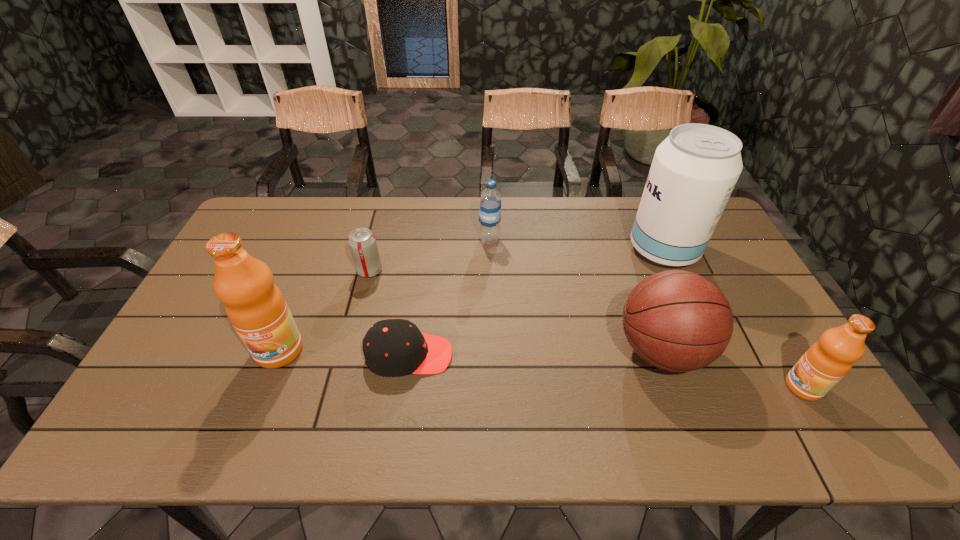
If the aim is uniform spacing by inserting an additional fruit_juice among them, please point to a vacant space for this new fruit_juice. Please provide its 2D coordinates. Your answer should be formatted as a tuple, i.e. [(x, y)], where the tuple contains the x and y coordinates of a point satisfying the conditions above.

[(532, 368)]